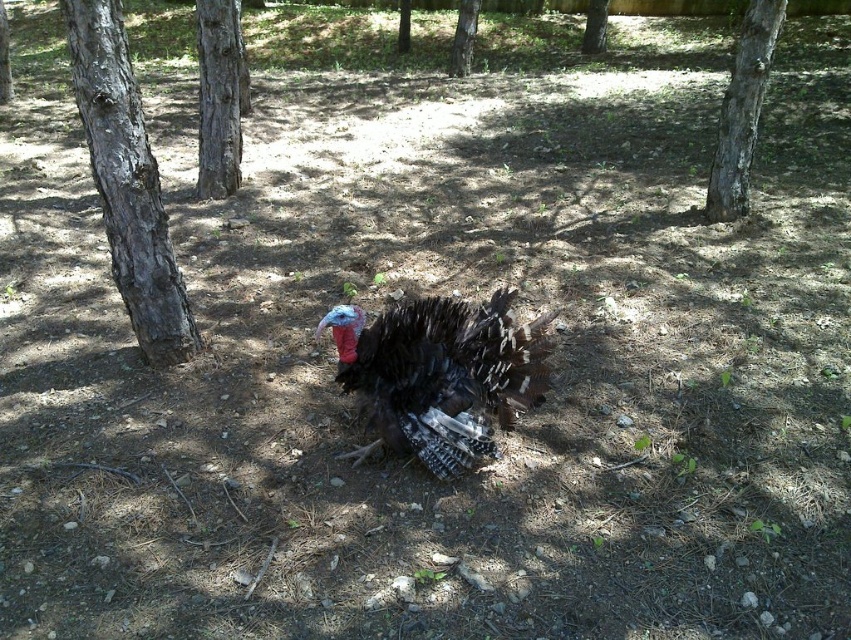
Question: Is dark brown bark tree at left positioned in front of smooth bark tree at right?

Choices:
 (A) no
 (B) yes

Answer: (B)

Question: Considering the real-world distances, which object is closest to the shiny black turkey at center?

Choices:
 (A) smooth bark tree at right
 (B) smooth bark tree at upper center

Answer: (A)

Question: Which point is closer to the camera?

Choices:
 (A) (741, 112)
 (B) (592, 44)
 (C) (545, 387)
 (D) (121, 132)

Answer: (C)

Question: Is shiny black turkey at center closer to the viewer compared to smooth bark tree at center?

Choices:
 (A) no
 (B) yes

Answer: (B)

Question: Which of the following is the farthest from the observer?

Choices:
 (A) shiny black turkey at center
 (B) smooth bark tree at right

Answer: (B)

Question: Can you confirm if dark brown bark tree at left is positioned to the left of smooth brown tree trunk at left?

Choices:
 (A) no
 (B) yes

Answer: (A)